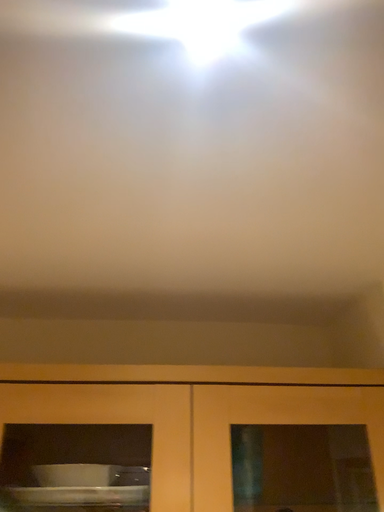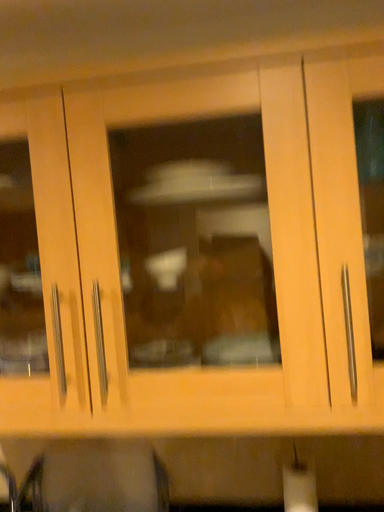
Question: How did the camera likely rotate when shooting the video?

Choices:
 (A) rotated downward
 (B) rotated upward

Answer: (A)